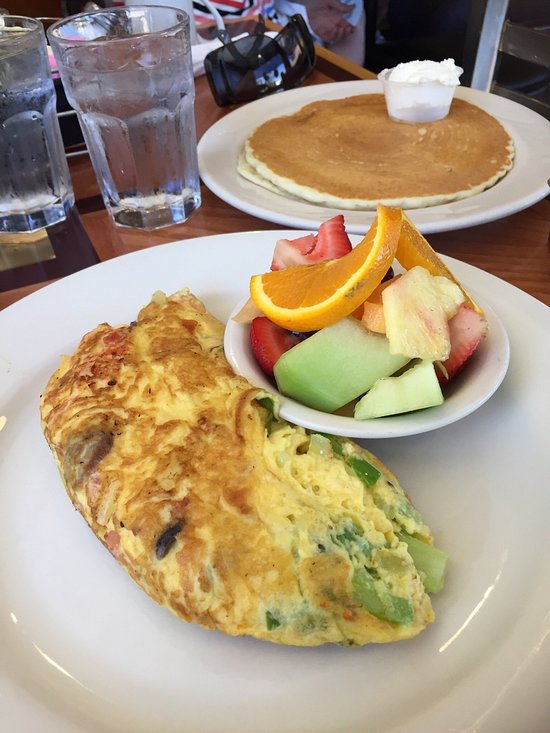
Locate an element on the screen. This screenshot has width=550, height=733. brown table is located at coordinates 525,253.